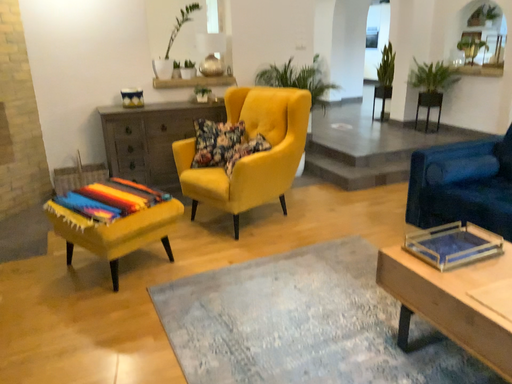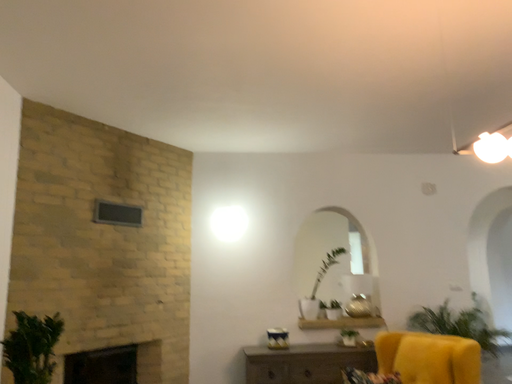
Question: Which way did the camera rotate in the video?

Choices:
 (A) rotated downward
 (B) rotated upward

Answer: (B)